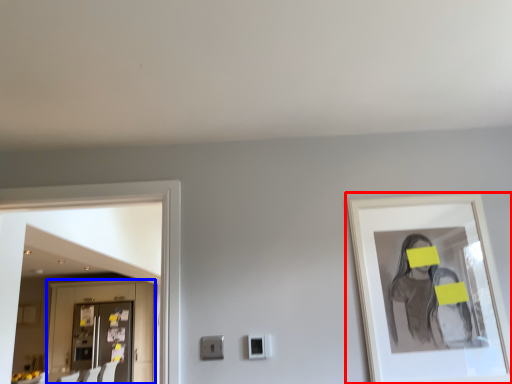
Question: Which point is further to the camera, picture frame (highlighted by a red box) or cabinetry (highlighted by a blue box)?

Choices:
 (A) picture frame
 (B) cabinetry

Answer: (B)